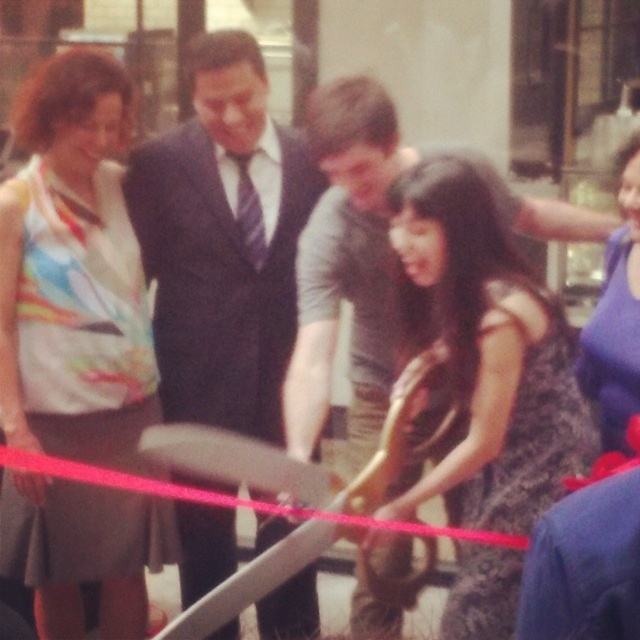
You are attending a ribbon cutting ceremony and need to locate the dark blue suit at center. Based on the coordinates provided, where would you find it in relation to the main action happening at the center of the image?

The dark blue suit at center is located at coordinates point (224, 241), which is slightly to the left and below the center of the image.

You are standing at the origin point of the image coordinate system. You want to move towards the dark blue suit at center located at point [224,241]. What direction should you move in?

Since the point is at [224,241], which is the dark blue suit at center, you should move towards that coordinate to reach it.